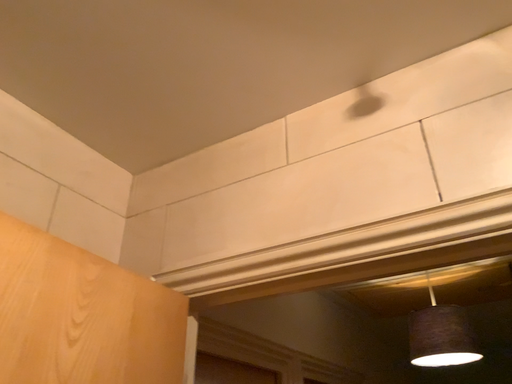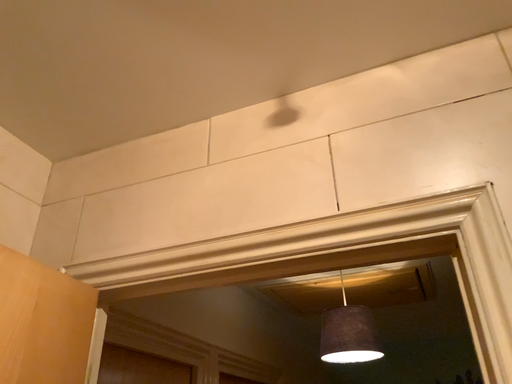
Question: Which way did the camera rotate in the video?

Choices:
 (A) rotated right
 (B) rotated left

Answer: (A)